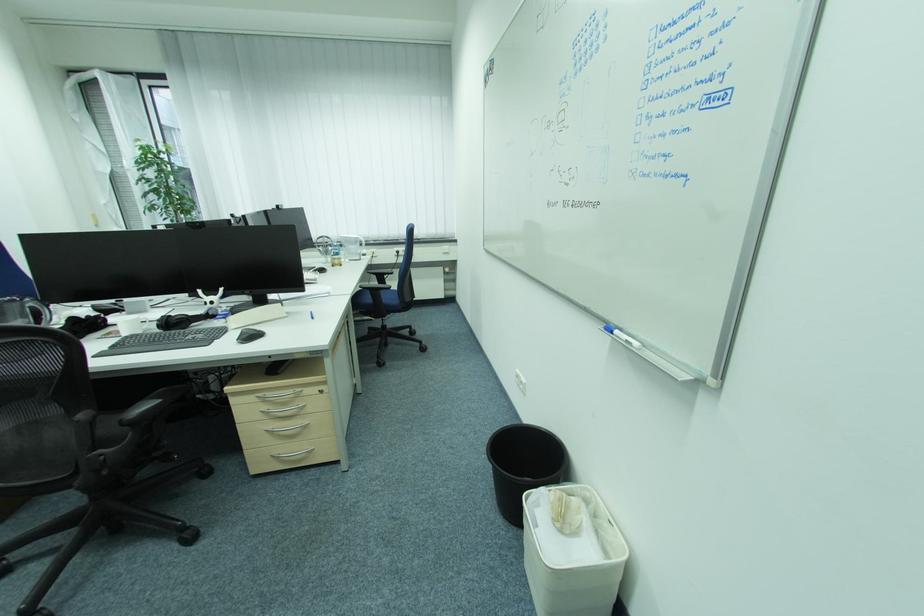
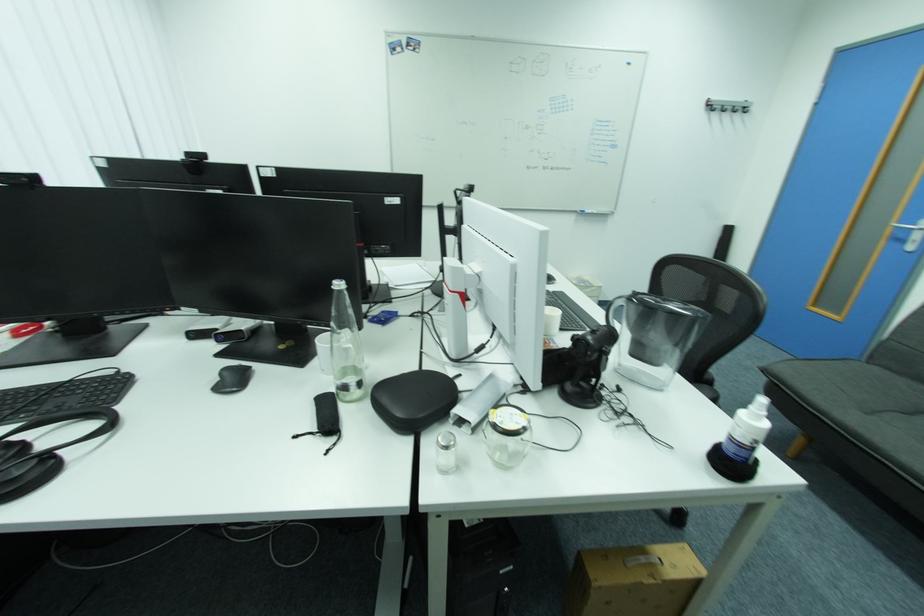
Question: I am providing you with two images of the same scene from different viewpoints. Which of the following objects are not visible in image2?

Choices:
 (A) blue weight plate
 (B) black headphones
 (C) silver door handle
 (D) clear glass bottle

Answer: (B)